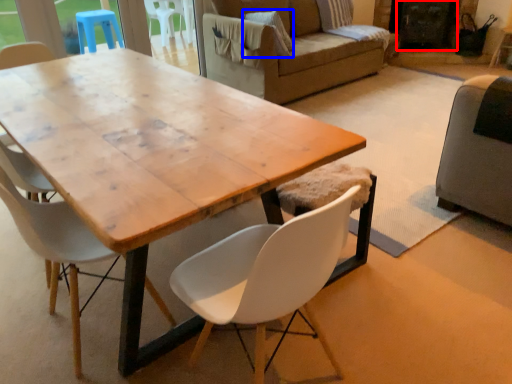
Question: Which object is closer to the camera taking this photo, screen door (highlighted by a red box) or pillow (highlighted by a blue box)?

Choices:
 (A) screen door
 (B) pillow

Answer: (B)